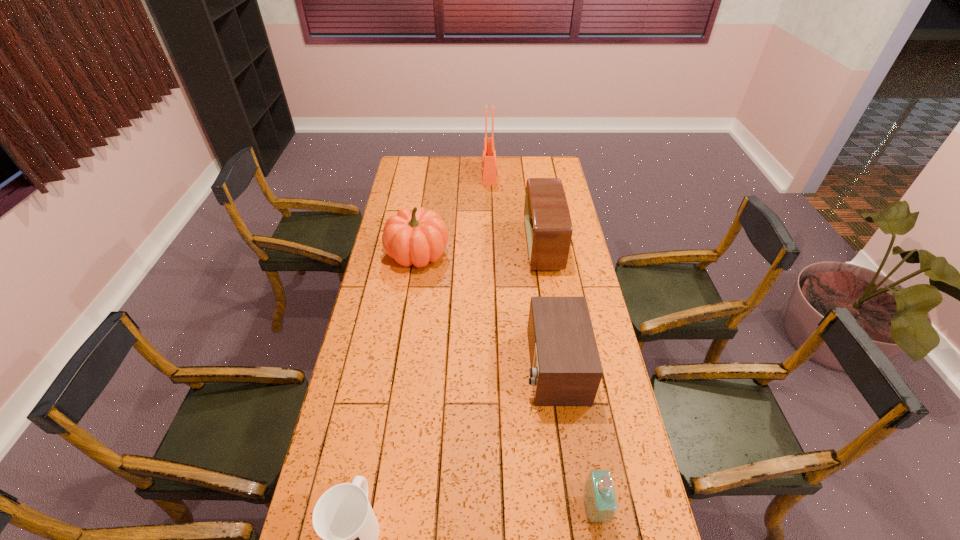
Locate an element on the screen. The height and width of the screenshot is (540, 960). the third object from left to right is located at coordinates (489, 166).

The height and width of the screenshot is (540, 960). I want to click on tote bag, so point(489,166).

Locate an element on the screen. The image size is (960, 540). the farther radio receiver is located at coordinates (548, 225).

Identify the location of pumpkin. The image size is (960, 540). (417, 237).

At what (x,y) coordinates should I click in order to perform the action: click on the shorter radio receiver. Please return your answer as a coordinate pair (x, y). This screenshot has width=960, height=540. Looking at the image, I should click on (566, 370).

Locate an element on the screen. The width and height of the screenshot is (960, 540). the third nearest object is located at coordinates (566, 370).

Identify the location of perfume. (600, 500).

Where is `vacant space located on the logo side of the tallest object`? vacant space located on the logo side of the tallest object is located at coordinates (435, 174).

Locate an element on the screen. The image size is (960, 540). vacant space positioned 0.310m on the logo side of the tallest object is located at coordinates (423, 174).

Identify the location of vacant space situated 0.360m on the logo side of the tallest object. This screenshot has width=960, height=540. (415, 174).